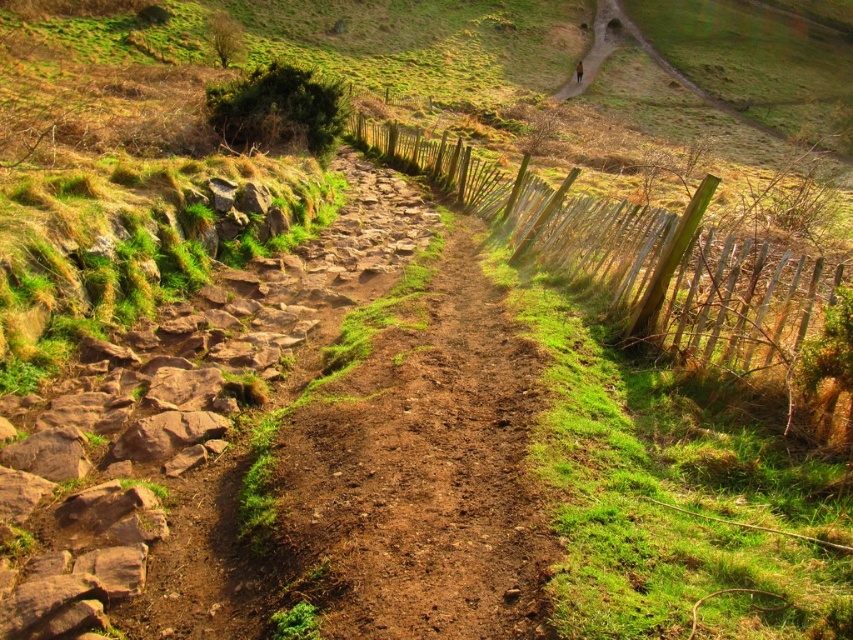
Can you confirm if brown dirt track at center is thinner than wooden picket fence at center-right?

Yes.

Between brown dirt track at center and wooden picket fence at center-right, which one is positioned lower?

brown dirt track at center is below.

Between point (306, 468) and point (433, 182), which one is positioned behind?

The point (433, 182) is behind.

Locate an element on the screen. The width and height of the screenshot is (853, 640). brown dirt track at center is located at coordinates (409, 465).